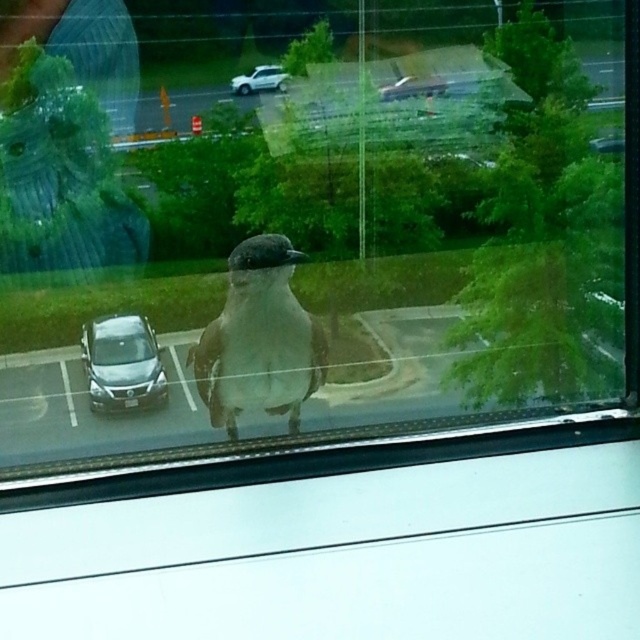
The image size is (640, 640). What do you see at coordinates (122, 364) in the screenshot?
I see `satin silver car at lower left` at bounding box center [122, 364].

Between point (152, 385) and point (250, 81), which one is positioned behind?

The point (152, 385) is behind.

You are a GUI agent. You are given a task and a screenshot of the screen. Output one action in this format:
    pyautogui.click(x=<x>, y=<y>)
    Task: Click on the satin silver car at lower left
    The height and width of the screenshot is (640, 640).
    Given the screenshot: What is the action you would take?
    pyautogui.click(x=122, y=364)

Which of these two, gray matte bird at center or white matte car at center, stands shorter?

white matte car at center

Does gray matte bird at center appear under white matte car at center?

Yes, gray matte bird at center is below white matte car at center.

Who is more forward, (x=262, y=234) or (x=246, y=76)?

Point (x=262, y=234) is in front.

I want to click on gray matte bird at center, so click(259, 339).

What do you see at coordinates (259, 339) in the screenshot? I see `gray matte bird at center` at bounding box center [259, 339].

Does gray matte bird at center appear on the left side of satin silver car at lower left?

Incorrect, gray matte bird at center is not on the left side of satin silver car at lower left.

The image size is (640, 640). I want to click on gray matte bird at center, so click(x=259, y=339).